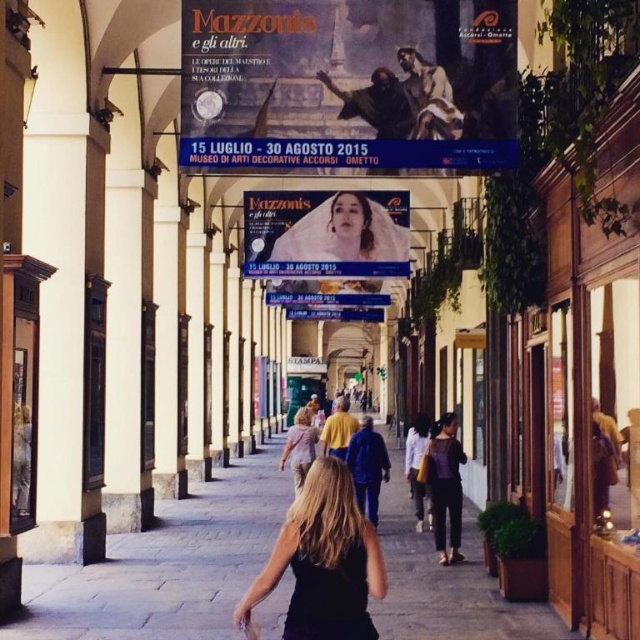
You are a tourist visiting this Italian arcade and you want to buy the black matte dress at center. Where exactly should you look to find it?

The black matte dress at center is located at point coordinates of (323,561).

You are an art student visiting the arcade and want to take a photo of both the matte oil painting at upper center and the pastel pink fabric at center. Which object will appear smaller in your photo?

The matte oil painting at upper center will appear smaller in the photo because it occupies less space than the pastel pink fabric at center.